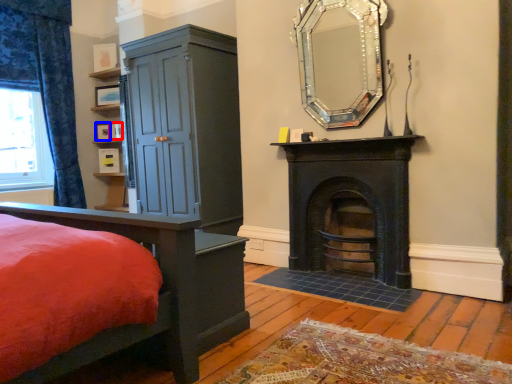
Question: Which object is closer to the camera taking this photo, picture frame (highlighted by a red box) or picture frame (highlighted by a blue box)?

Choices:
 (A) picture frame
 (B) picture frame

Answer: (A)